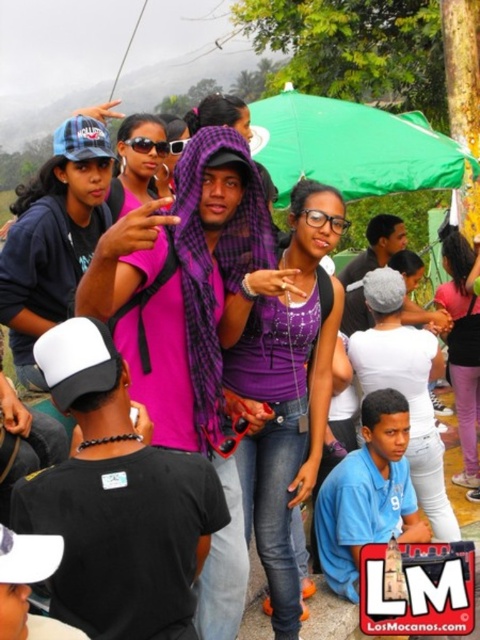
Question: Which of the following is the closest to the observer?

Choices:
 (A) green fabric umbrella at upper center
 (B) purple matte scarf at center
 (C) pink fabric scarf at center

Answer: (B)

Question: Is purple matte scarf at center further to camera compared to green fabric umbrella at upper center?

Choices:
 (A) yes
 (B) no

Answer: (B)

Question: Which point appears closest to the camera in this image?

Choices:
 (A) (285, 632)
 (B) (351, 140)
 (C) (451, 284)

Answer: (A)

Question: Is purple matte scarf at center to the right of green fabric umbrella at upper center from the viewer's perspective?

Choices:
 (A) yes
 (B) no

Answer: (B)

Question: Which object is closer to the camera taking this photo?

Choices:
 (A) purple matte scarf at center
 (B) pink fabric scarf at center
 (C) green fabric umbrella at upper center

Answer: (A)

Question: Does green fabric umbrella at upper center appear over pink fabric scarf at center?

Choices:
 (A) no
 (B) yes

Answer: (B)